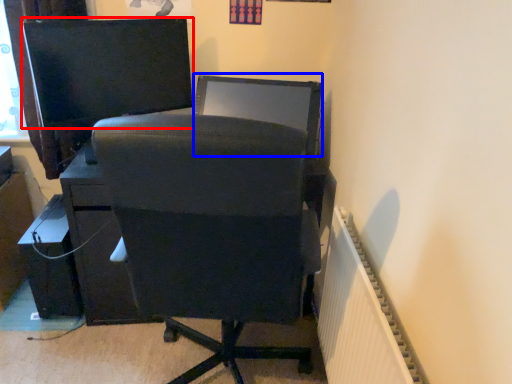
Question: Which object is further to the camera taking this photo, computer monitor (highlighted by a red box) or computer monitor (highlighted by a blue box)?

Choices:
 (A) computer monitor
 (B) computer monitor

Answer: (B)